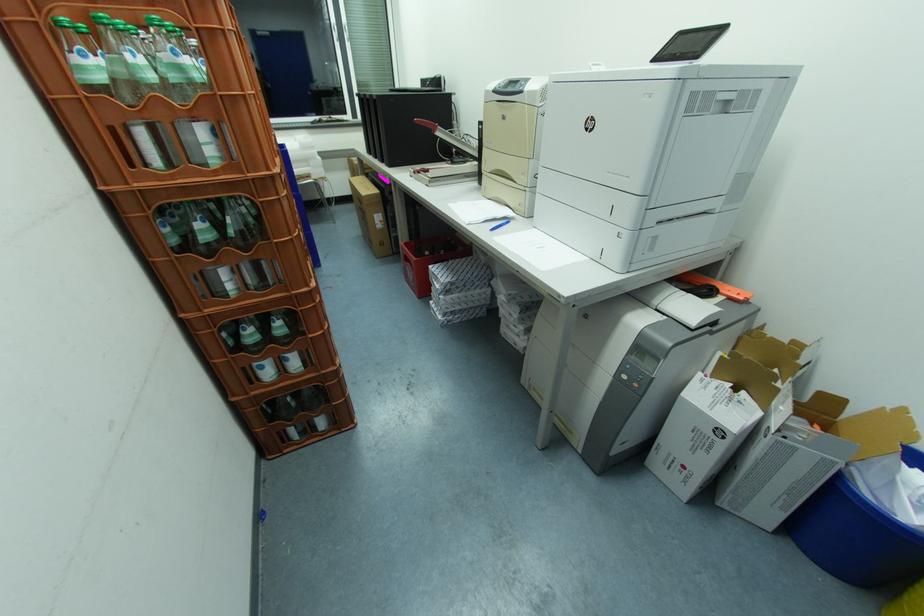
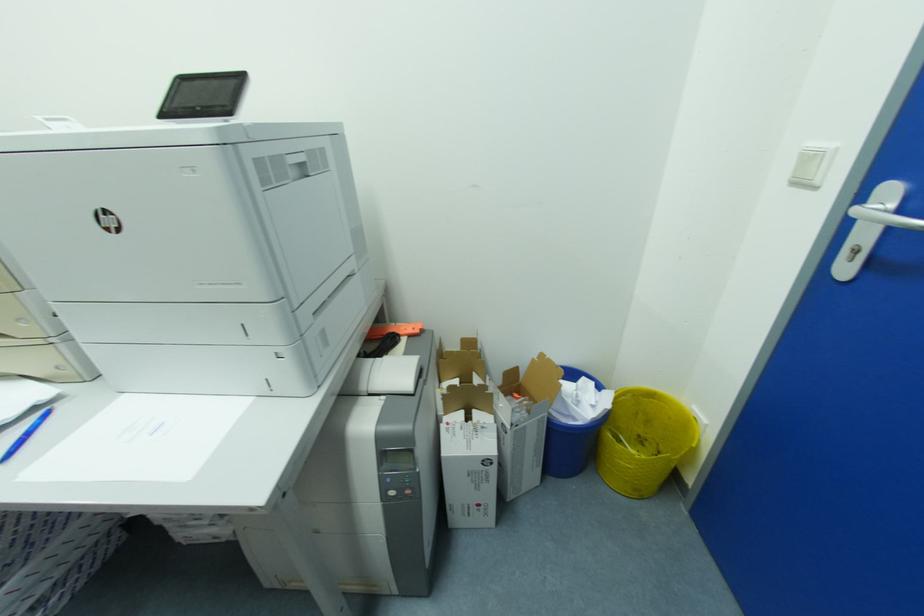
Question: The camera is either moving clockwise (left) or counter-clockwise (right) around the object. The first image is from the beginning of the video and the second image is from the end. Is the camera moving left or right when shooting the video?

Choices:
 (A) Left
 (B) Right

Answer: (A)